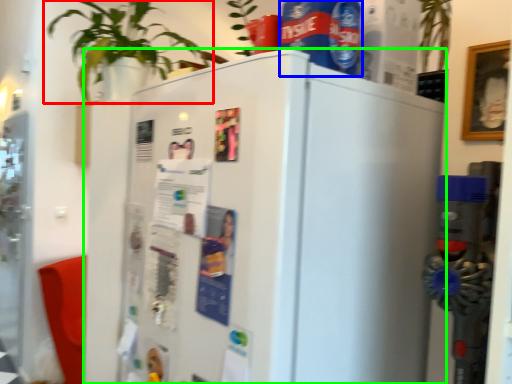
Question: Which object is positioned closest to houseplant (highlighted by a red box)? Select from beverage (highlighted by a blue box) and refrigerator (highlighted by a green box).

Choices:
 (A) beverage
 (B) refrigerator

Answer: (B)